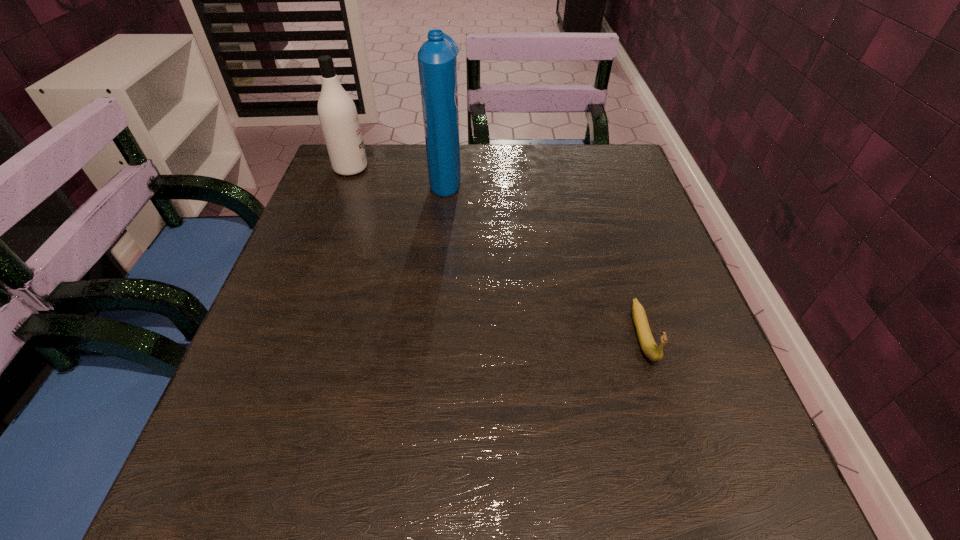
The height and width of the screenshot is (540, 960). In order to click on unoccupied area between the tallest object and the leftmost object in this screenshot , I will do `click(398, 171)`.

Locate an element on the screen. The width and height of the screenshot is (960, 540). vacant space that is in between the banana and the leftmost object is located at coordinates pyautogui.click(x=496, y=252).

The image size is (960, 540). Find the location of `free point between the second object from right to left and the shortest object`. free point between the second object from right to left and the shortest object is located at coordinates (544, 255).

Where is `empty space between the right shampoo and the shorter shampoo`? The image size is (960, 540). empty space between the right shampoo and the shorter shampoo is located at coordinates (398, 171).

Image resolution: width=960 pixels, height=540 pixels. I want to click on unoccupied area between the shortest object and the second tallest object, so click(496, 252).

Find the location of a particular element. The width and height of the screenshot is (960, 540). blank region between the shorter shampoo and the shortest object is located at coordinates pyautogui.click(x=496, y=252).

Identify the location of empty location between the rightmost object and the second shortest object. (496, 252).

Locate an element on the screen. Image resolution: width=960 pixels, height=540 pixels. free area in between the leftmost object and the banana is located at coordinates (496, 252).

The width and height of the screenshot is (960, 540). I want to click on object that is the second nearest to the second shortest object, so click(653, 352).

At what (x,y) coordinates should I click in order to perform the action: click on object that stands as the closest to the shortest object. Please return your answer as a coordinate pair (x, y). The width and height of the screenshot is (960, 540). Looking at the image, I should click on (437, 62).